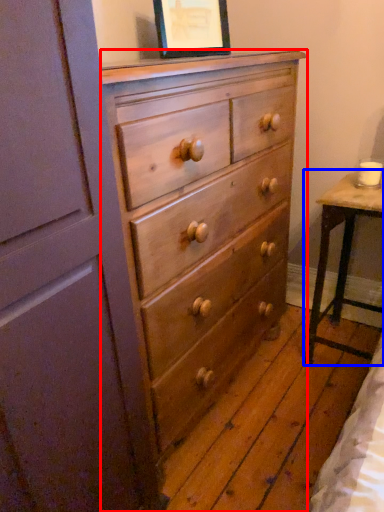
Question: Among these objects, which one is farthest to the camera, chest of drawers (highlighted by a red box) or table (highlighted by a blue box)?

Choices:
 (A) chest of drawers
 (B) table

Answer: (B)